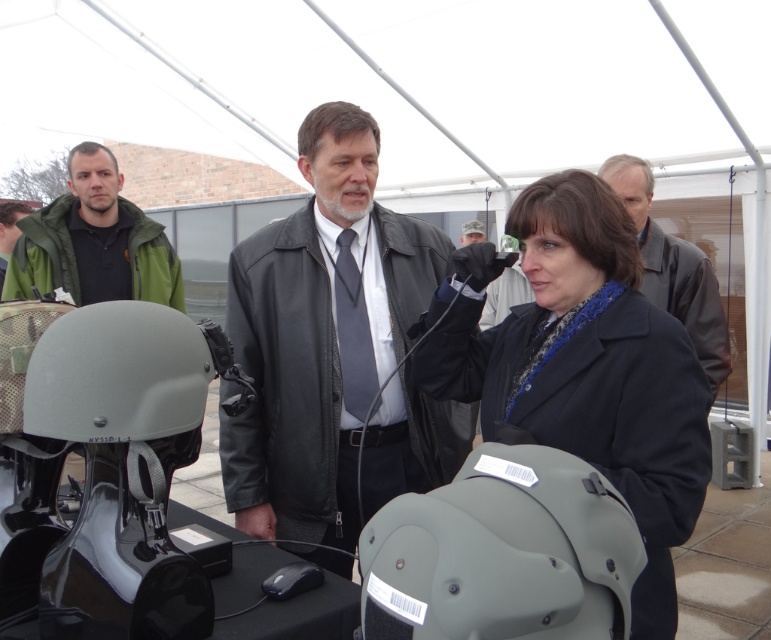
You are standing in front of the black table with helmets and a computer mouse. There are two points marked on the table. The first point is at coordinates point (635, 212) and the second point is at point (2, 250). Which point is closer to you?

Point (635, 212) is closer to the viewer than point (2, 250).

Looking at this image, you are a security officer at an event. You need to choose an item to place on a narrow shelf that can only hold items up to 5 cm in thickness. Which item from the olive matte helmet at center and the leather jacket at upper right should you choose?

The olive matte helmet at center is thinner than the leather jacket at upper right, so you should choose the olive matte helmet at center to place on the narrow shelf.

You are an event organizer at the outdoor exhibition. You need to hang the leather jacket at upper right and the green fabric jacket at left on a rack. Which jacket should you hang first to ensure the one on top is the one that is visually more prominent?

The green fabric jacket at left should be hung first on the rack since the leather jacket at upper right is positioned under it in the image, meaning the green fabric jacket is above and thus more visually prominent.